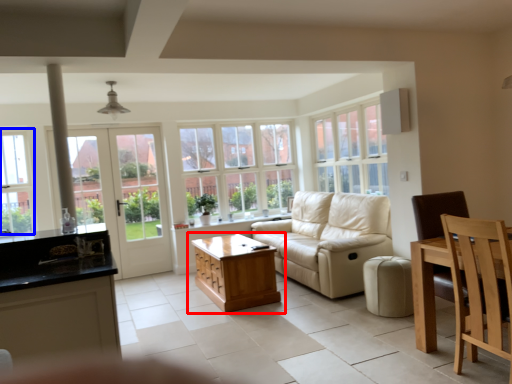
Question: Which object appears closest to the camera in this image, table (highlighted by a red box) or window (highlighted by a blue box)?

Choices:
 (A) table
 (B) window

Answer: (A)